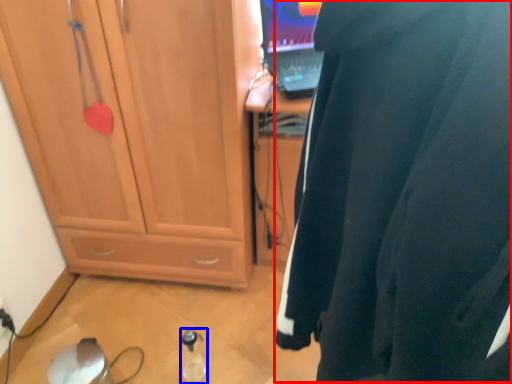
Question: Which point is further to the camera, wetsuit (highlighted by a red box) or bottle (highlighted by a blue box)?

Choices:
 (A) wetsuit
 (B) bottle

Answer: (B)